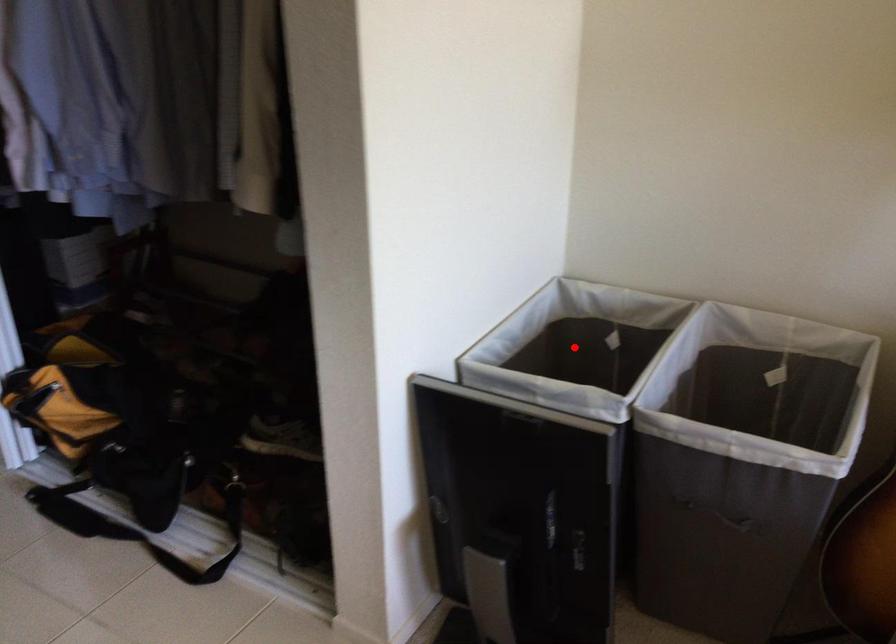
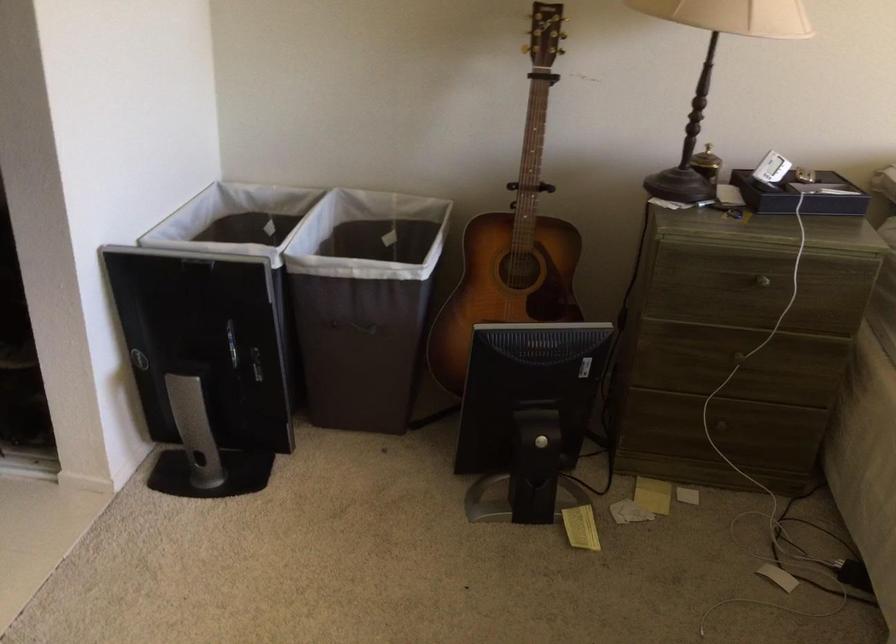
Locate, in the second image, the point that corresponds to the highlighted location in the first image.

(239, 241)